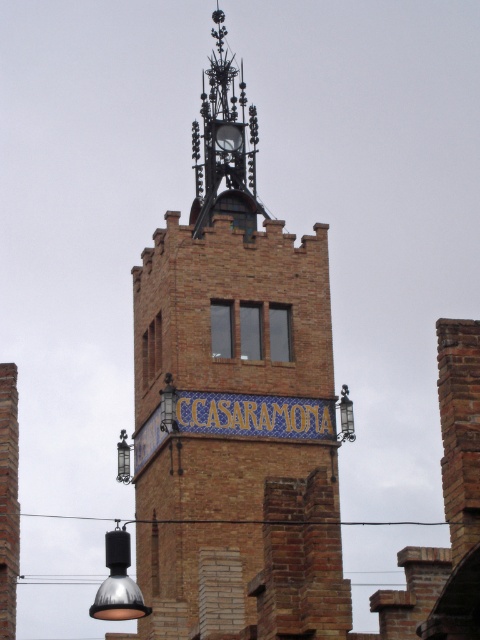
You are standing in front of the brown brick tower at center and the matte black lamp at center. Which object is taller?

The brown brick tower at center is much taller than the matte black lamp at center.

You are standing in front of the brick tower and want to locate two specific points marked on the tower. The first point is at coordinate point (165, 328) and the second is at point (119, 477). Which point is closer to you?

Point (165, 328) is in front of point (119, 477), so the first point is closer to you.

Consider the image. You are standing at a point 320.28 feet away from the tower. If you want to take a photo of the tower with the decorative sign clearly visible, where should you position yourself relative to the point marked at coordinates (230,243)?

You should position yourself at the point marked at coordinates (230,243) since that is exactly where you need to be to be 320.28 feet away from the tower to capture the decorative sign clearly.